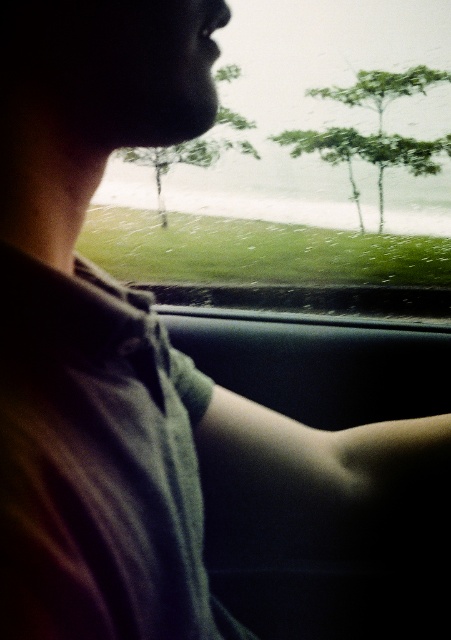
You are a passenger in the car and notice two trees outside the window. The driver is pointing at one of them. Which tree is more to the left, the green leafy tree at upper center or the green matte tree at center?

The green matte tree at center is more to the left because the green leafy tree at upper center is positioned to the right of it.

You are a passenger in the car and want to estimate how far the green leafy tree at upper center is from the car. What is the approximate distance?

The green leafy tree at upper center is approximately 9.87 meters away from the car.

You are a passenger in the car and want to look at the green matte tree at center outside through the transparent glass windshield at upper center. Can you see the entire tree through the windshield?

The transparent glass windshield at upper center has a greater height compared to green matte tree at center, so yes, you can see the entire tree through the windshield.